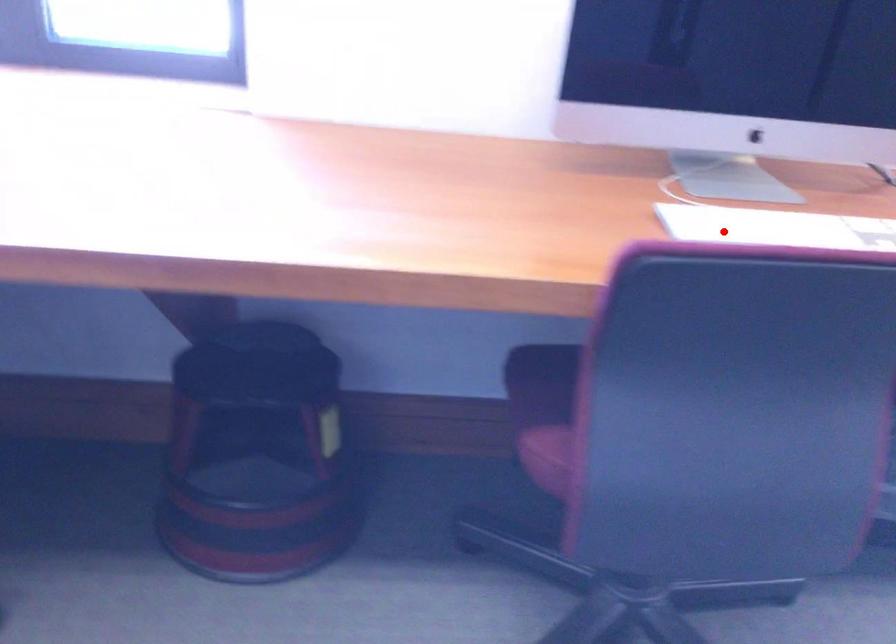
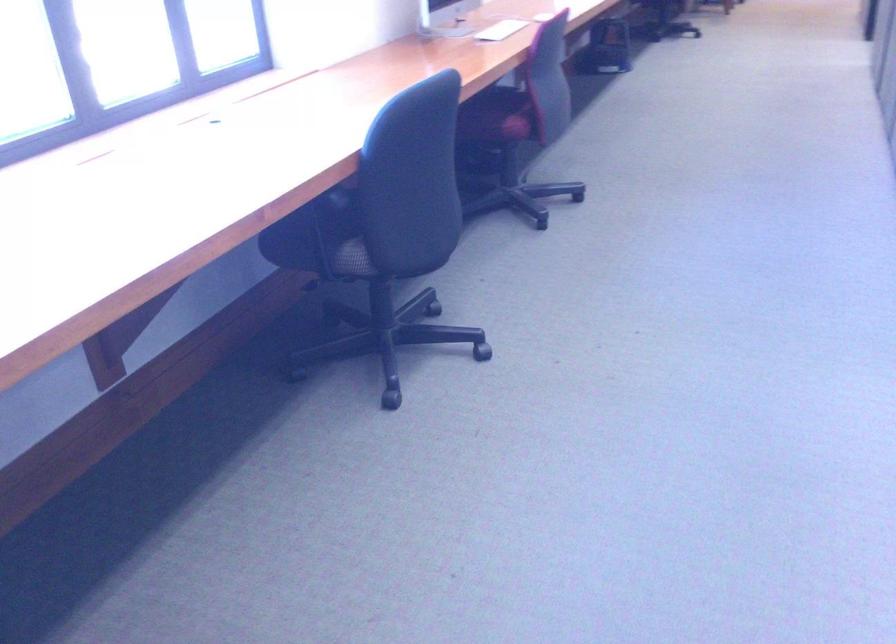
Find the pixel in the second image that matches the highlighted location in the first image.

(501, 30)